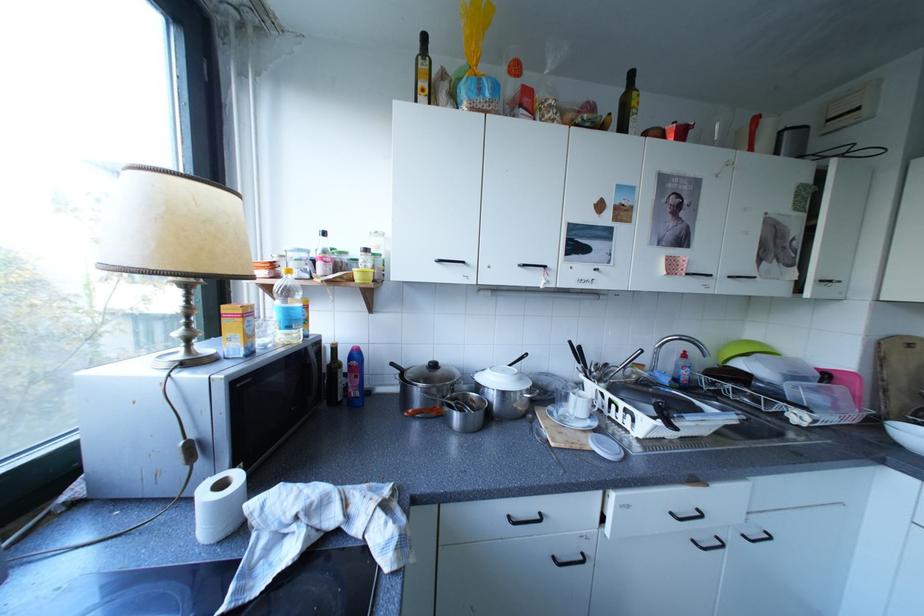
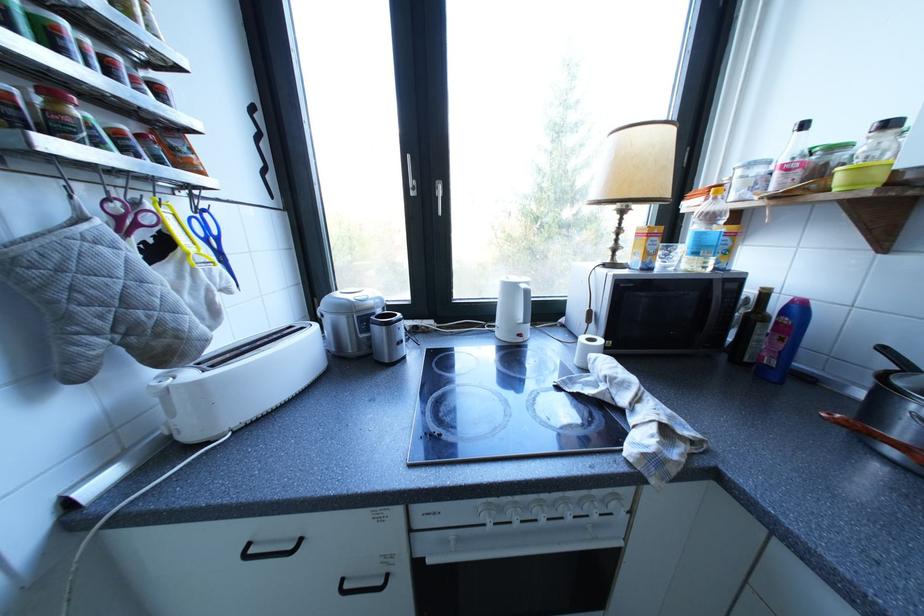
Where in the second image is the point corresponding to the point at 362,358 from the first image?

(797, 312)